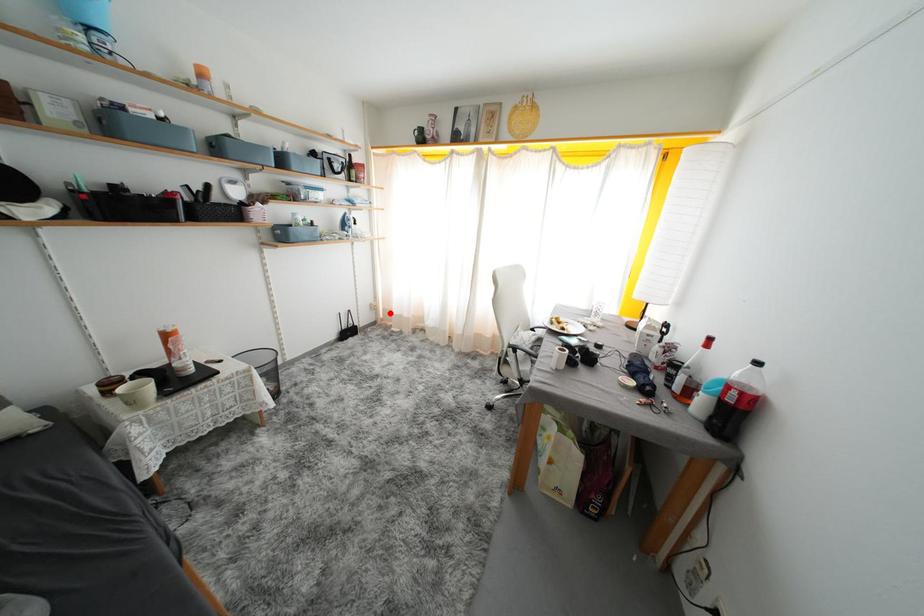
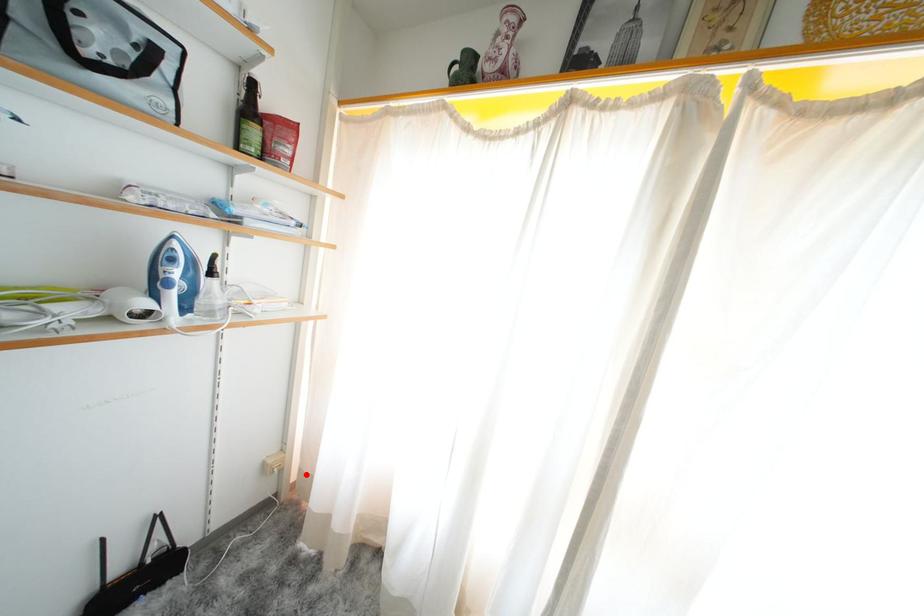
I am providing you with two images of the same scene from different viewpoints. A red point is marked on the first image and another point is marked on the second image. Does the point marked in image1 correspond to the same location as the one in image2?

Yes